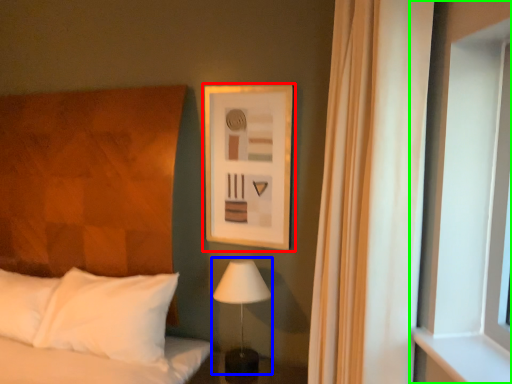
Question: Which object is positioned closest to picture frame (highlighted by a red box)? Select from table lamp (highlighted by a blue box) and window (highlighted by a green box).

Choices:
 (A) table lamp
 (B) window

Answer: (A)